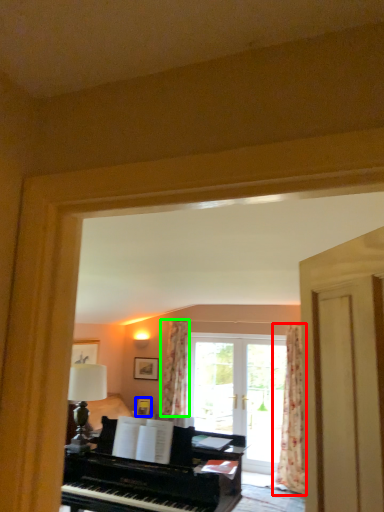
Question: Which object is the closest to the curtain (highlighted by a red box)? Choose among these: picture frame (highlighted by a blue box) or curtain (highlighted by a green box).

Choices:
 (A) picture frame
 (B) curtain

Answer: (B)